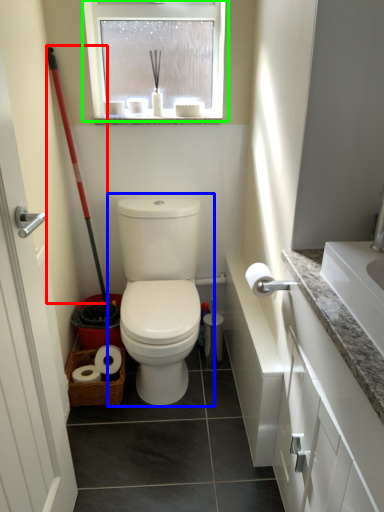
Question: Based on their relative distances, which object is farther from shovel (highlighted by a red box)? Choose from toilet (highlighted by a blue box) and window (highlighted by a green box).

Choices:
 (A) toilet
 (B) window

Answer: (A)